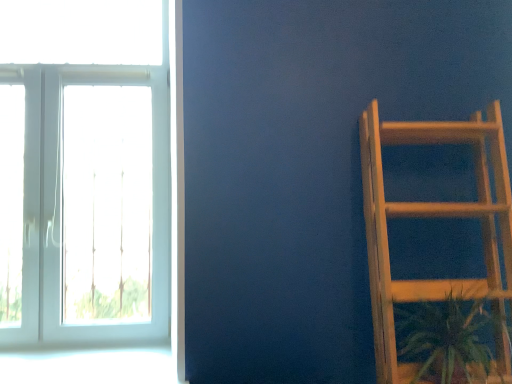
Question: Should I look upward or downward to see green leafy plant at lower right?

Choices:
 (A) down
 (B) up

Answer: (A)

Question: Is the position of white glass window at left less distant than that of green leafy plant at lower right?

Choices:
 (A) no
 (B) yes

Answer: (A)

Question: Can you confirm if white glass window at left is bigger than green leafy plant at lower right?

Choices:
 (A) yes
 (B) no

Answer: (A)

Question: Is white glass window at left oriented away from green leafy plant at lower right?

Choices:
 (A) yes
 (B) no

Answer: (B)

Question: From the image's perspective, is white glass window at left beneath green leafy plant at lower right?

Choices:
 (A) no
 (B) yes

Answer: (A)

Question: Does white glass window at left have a lesser width compared to green leafy plant at lower right?

Choices:
 (A) yes
 (B) no

Answer: (A)

Question: Can you confirm if white glass window at left is shorter than green leafy plant at lower right?

Choices:
 (A) no
 (B) yes

Answer: (A)

Question: From a real-world perspective, is white glass window at left beneath wooden ladder at right?

Choices:
 (A) no
 (B) yes

Answer: (A)

Question: Can you confirm if white glass window at left is bigger than wooden ladder at right?

Choices:
 (A) no
 (B) yes

Answer: (B)

Question: Is the position of white glass window at left less distant than that of wooden ladder at right?

Choices:
 (A) no
 (B) yes

Answer: (A)

Question: Is white glass window at left facing away from wooden ladder at right?

Choices:
 (A) yes
 (B) no

Answer: (B)

Question: Does white glass window at left turn towards wooden ladder at right?

Choices:
 (A) yes
 (B) no

Answer: (B)

Question: Can you confirm if white glass window at left is shorter than wooden ladder at right?

Choices:
 (A) no
 (B) yes

Answer: (A)

Question: Considering the relative sizes of wooden ladder at right and white glass window at left in the image provided, is wooden ladder at right taller than white glass window at left?

Choices:
 (A) no
 (B) yes

Answer: (A)